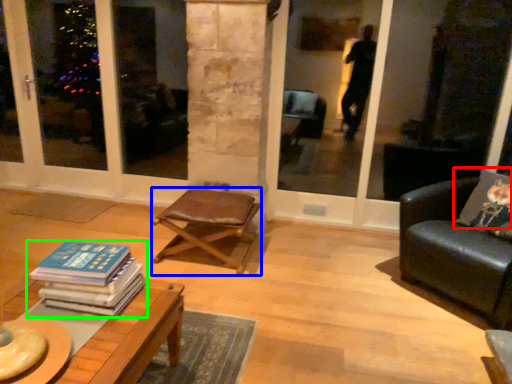
Question: Considering the real-world distances, which object is farthest from pillow (highlighted by a red box)? chair (highlighted by a blue box) or book (highlighted by a green box)?

Choices:
 (A) chair
 (B) book

Answer: (B)